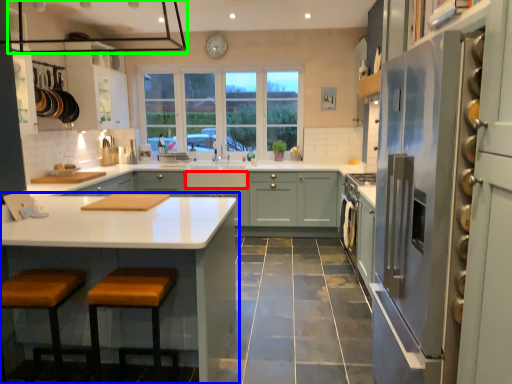
Question: Which object is the farthest from drawer (highlighted by a red box)? Choose among these: cabinetry (highlighted by a blue box) or exhaust hood (highlighted by a green box).

Choices:
 (A) cabinetry
 (B) exhaust hood

Answer: (A)